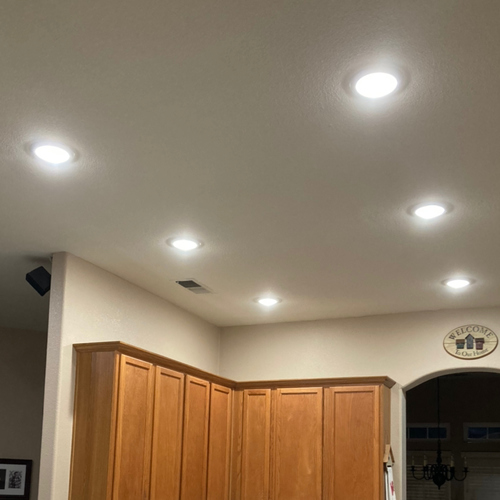
The width and height of the screenshot is (500, 500). What are the coordinates of `windows` in the screenshot? It's located at (418, 431), (481, 431).